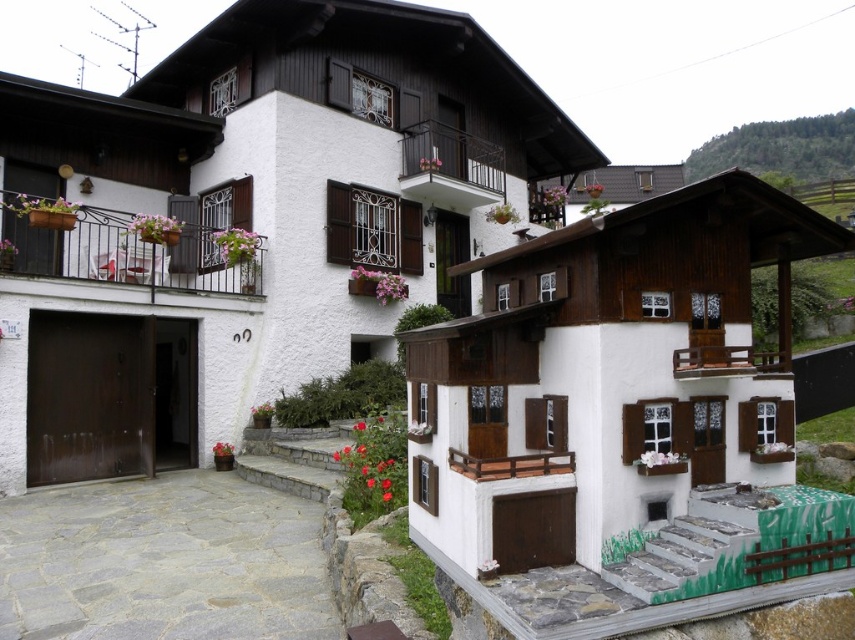
Question: Which point is closer to the camera?

Choices:
 (A) (401, 205)
 (B) (741, 358)
 (C) (522, 458)

Answer: (C)

Question: Observing the image, what is the correct spatial positioning of wooden balcony at left in reference to wooden at center?

Choices:
 (A) below
 (B) above

Answer: (B)

Question: Which of the following is the farthest from the observer?

Choices:
 (A) wooden balcony at left
 (B) wooden balcony at upper right

Answer: (A)

Question: Is green forested hillside at upper right positioned at the back of wooden at center?

Choices:
 (A) no
 (B) yes

Answer: (B)

Question: Based on their relative distances, which object is farther from the wooden balcony at upper right?

Choices:
 (A) wooden at center
 (B) green forested hillside at upper right

Answer: (B)

Question: Is wooden balcony at left positioned before black metal balcony at upper center?

Choices:
 (A) no
 (B) yes

Answer: (B)